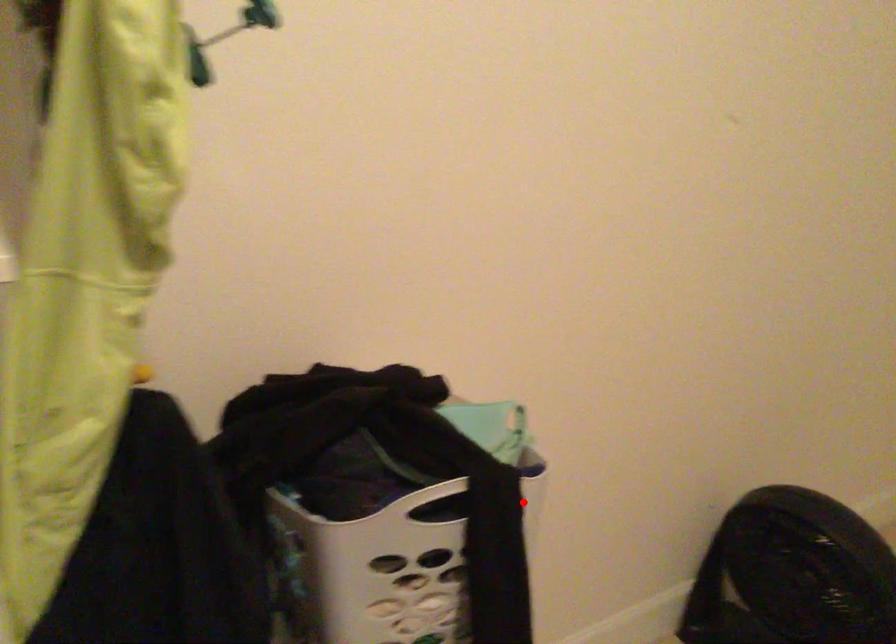
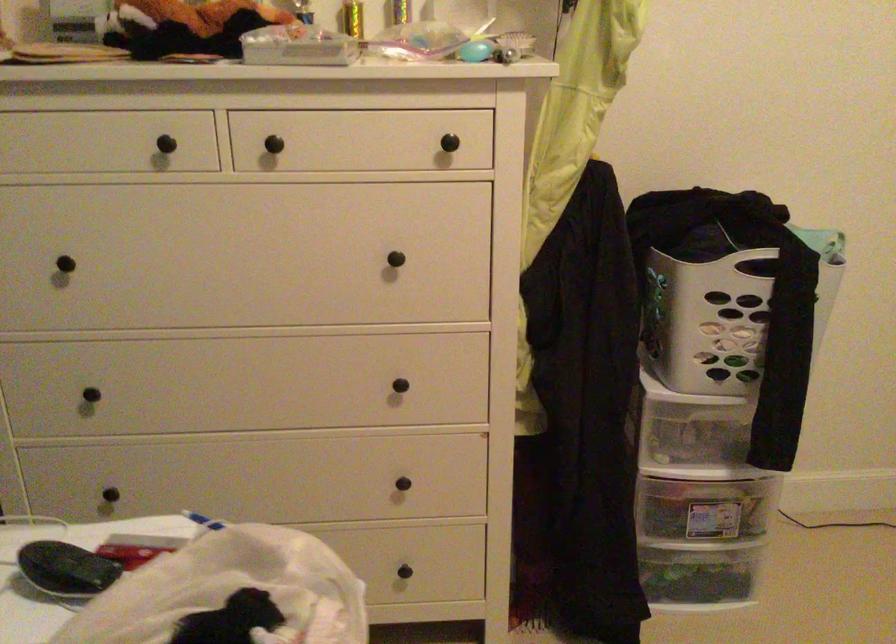
Question: I am providing you with two images of the same scene from different viewpoints. Image1 has a red point marked. In image2, the corresponding 3D location appears at what relative position? Reply with the corresponding letter.

Choices:
 (A) Closer
 (B) Farther

Answer: (B)